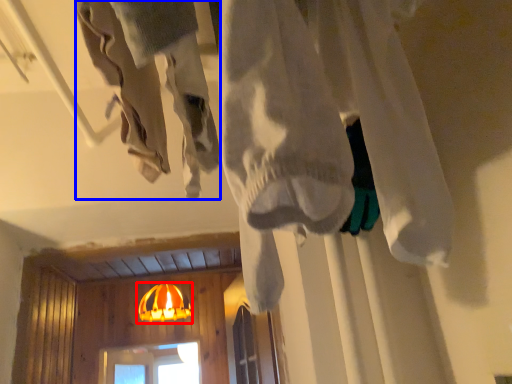
Question: Which point is closer to the camera, lamp (highlighted by a red box) or clothing (highlighted by a blue box)?

Choices:
 (A) lamp
 (B) clothing

Answer: (B)